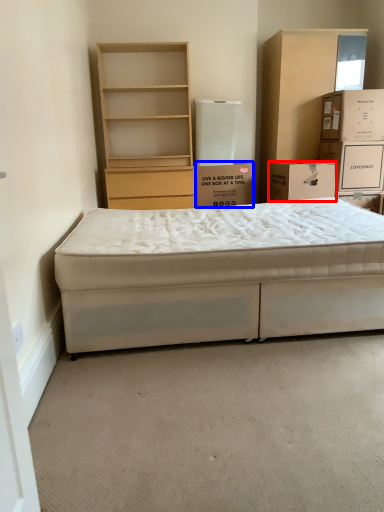
Question: Which object appears closest to the camera in this image, box (highlighted by a red box) or box (highlighted by a blue box)?

Choices:
 (A) box
 (B) box

Answer: (A)